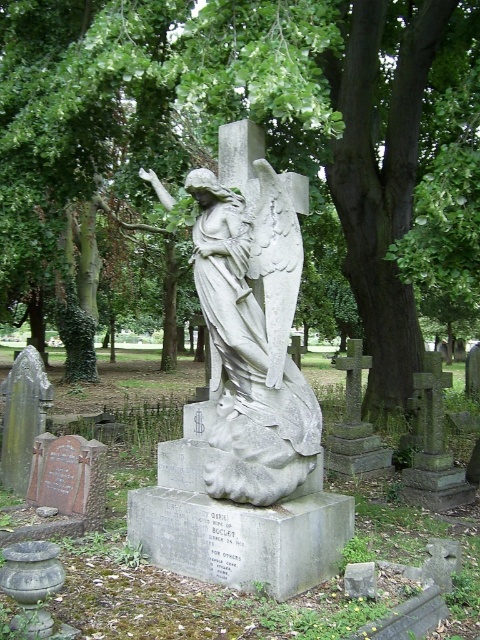
Question: Does green leafy tree at center appear on the left side of gray stone angel at center?

Choices:
 (A) yes
 (B) no

Answer: (A)

Question: Does green leafy tree at center appear on the left side of gray stone angel at center?

Choices:
 (A) yes
 (B) no

Answer: (A)

Question: Which of the following is the farthest from the observer?

Choices:
 (A) (235, 440)
 (B) (319, 115)

Answer: (B)

Question: Can you confirm if green leafy tree at center is thinner than gray stone angel at center?

Choices:
 (A) no
 (B) yes

Answer: (A)

Question: Which of the following is the closest to the observer?

Choices:
 (A) (11, 317)
 (B) (268, 435)

Answer: (B)